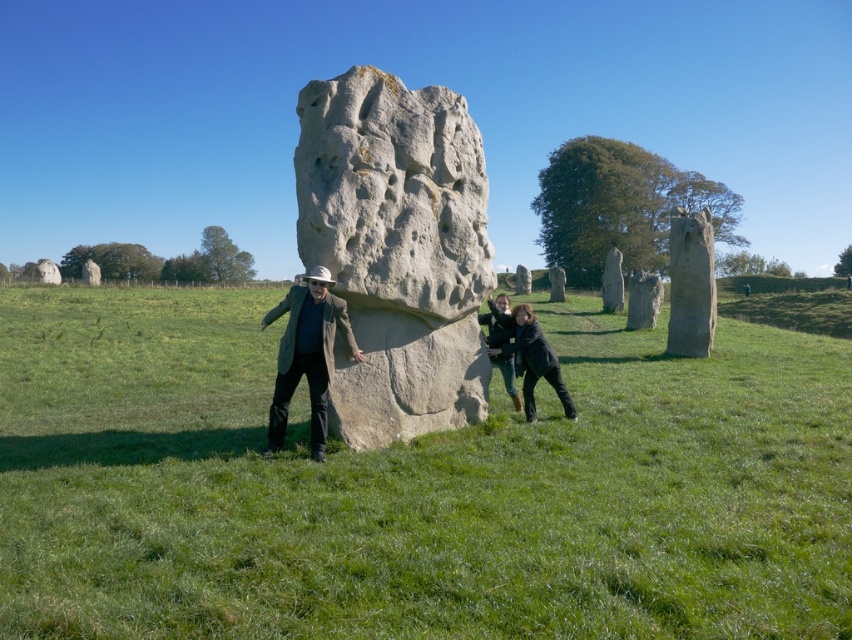
Is gray rough stone at center smaller than smooth stone monolith at center-right?

Yes.

Which is in front, point (453, 307) or point (605, 305)?

Point (453, 307) is in front.

Between point (442, 204) and point (607, 278), which one is positioned in front?

Point (442, 204)

This screenshot has width=852, height=640. I want to click on gray rough stone at center, so click(x=396, y=250).

The height and width of the screenshot is (640, 852). I want to click on dark gray jacket at center, so click(x=533, y=360).

In the scene shown: Who is positioned more to the left, dark gray jacket at center or smooth stone sculpture at center?

dark gray jacket at center

Is point (554, 385) less distant than point (519, 269)?

That is True.

Image resolution: width=852 pixels, height=640 pixels. What are the coordinates of `dark gray jacket at center` in the screenshot? It's located at (533, 360).

What are the coordinates of `dark green jacket at center` in the screenshot? It's located at (498, 321).

Measure the distance from dark green jacket at center to smooth stone sculpture at center.

A distance of 49.06 meters exists between dark green jacket at center and smooth stone sculpture at center.

Does point (492, 333) come closer to viewer compared to point (521, 275)?

Yes, point (492, 333) is in front of point (521, 275).

This screenshot has width=852, height=640. Find the location of `dark green jacket at center`. dark green jacket at center is located at coordinates (498, 321).